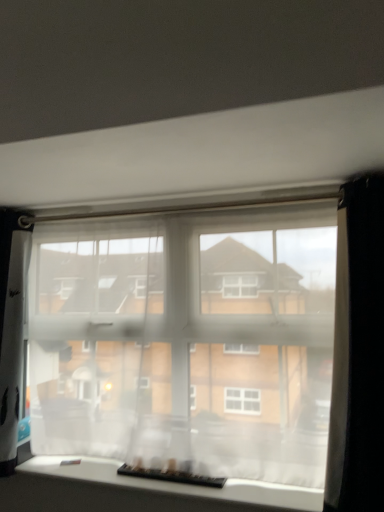
Where is `vacant area situated below black plastic keyboard at lower center (from a real-world perspective)`? vacant area situated below black plastic keyboard at lower center (from a real-world perspective) is located at coordinates (165, 475).